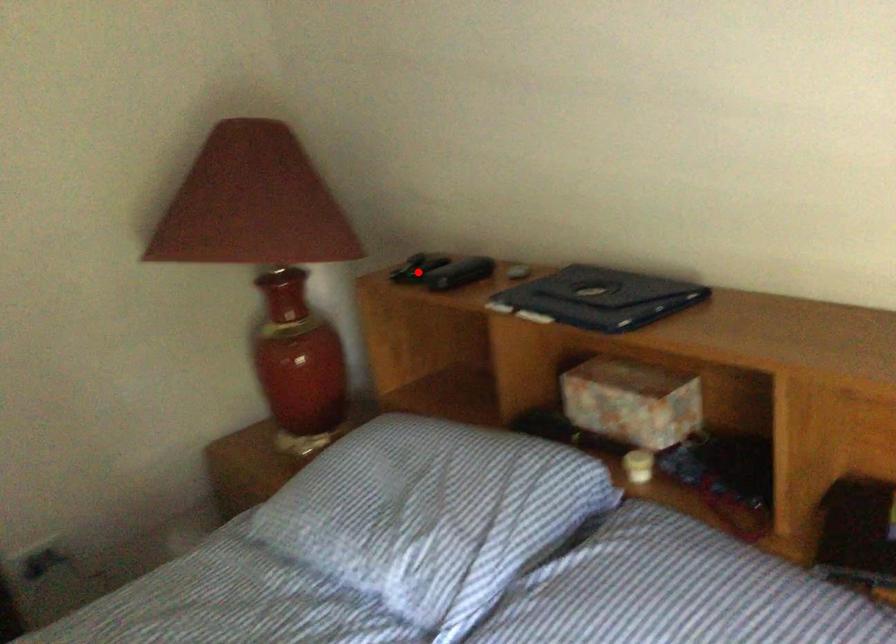
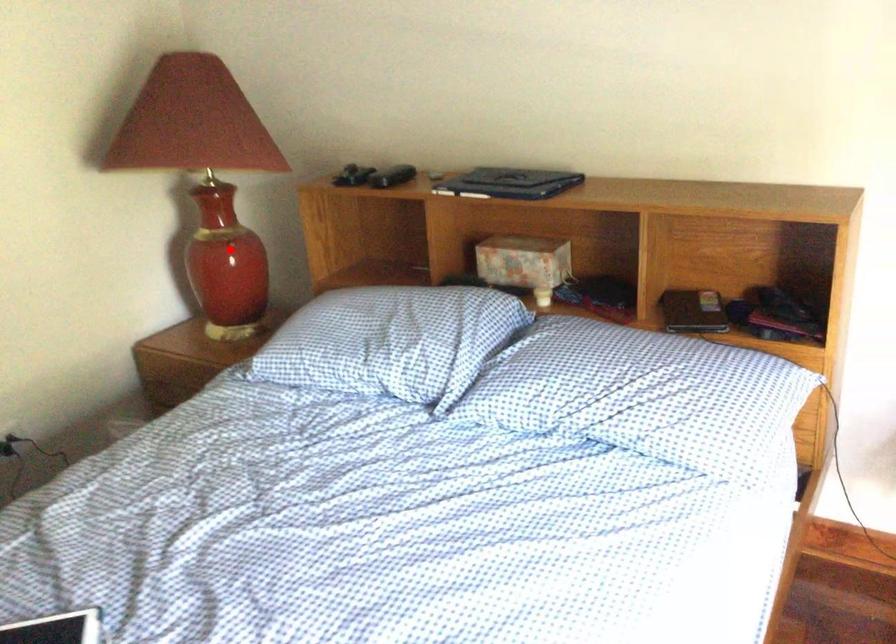
I am providing you with two images of the same scene from different viewpoints. A red point is marked on the first image and another point is marked on the second image. Is the red point in image1 aligned with the point shown in image2?

No